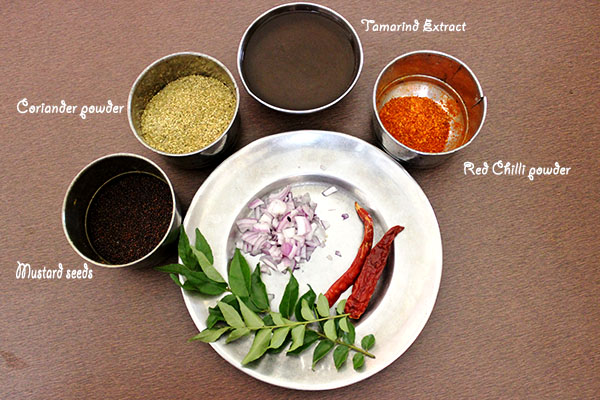
Where is `canister`? canister is located at coordinates [x=466, y=67].